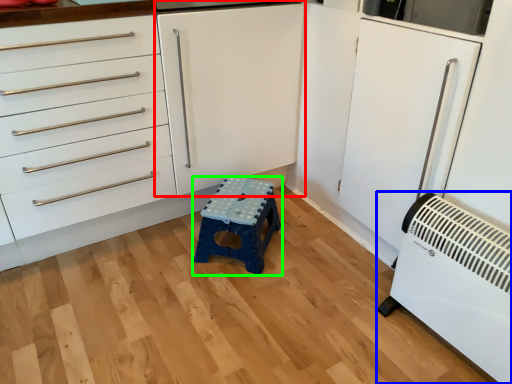
Question: Estimate the real-world distances between objects in this image. Which object is farther from cabinetry (highlighted by a red box), home appliance (highlighted by a blue box) or furniture (highlighted by a green box)?

Choices:
 (A) home appliance
 (B) furniture

Answer: (A)